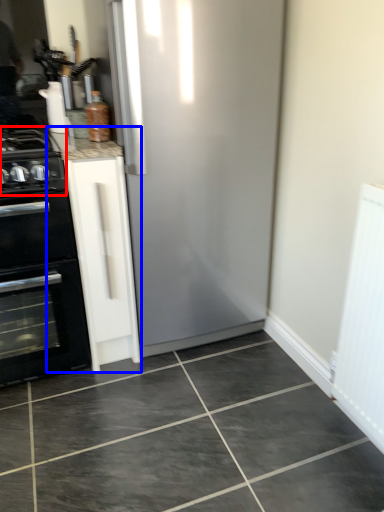
Question: Which object appears closest to the camera in this image, gas stove (highlighted by a red box) or cabinetry (highlighted by a blue box)?

Choices:
 (A) gas stove
 (B) cabinetry

Answer: (A)